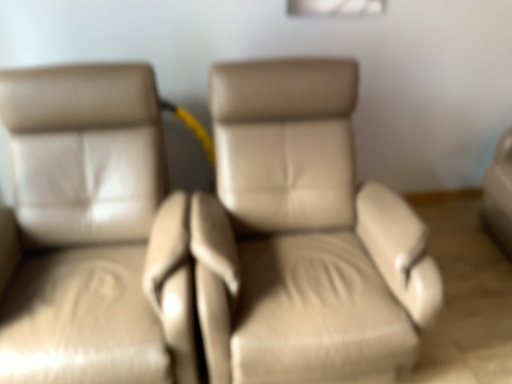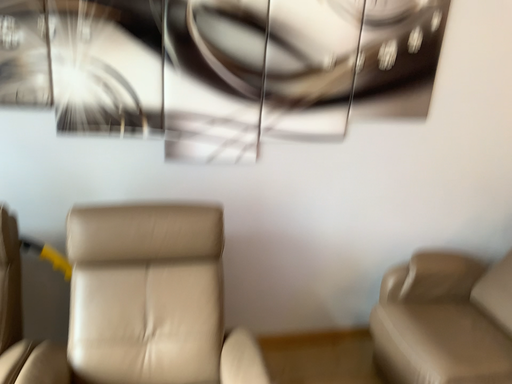
Question: Which way did the camera rotate in the video?

Choices:
 (A) rotated upward
 (B) rotated downward

Answer: (A)